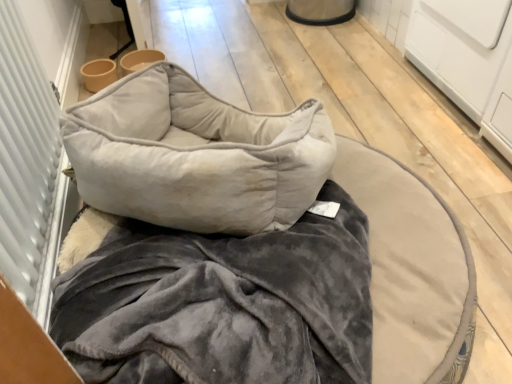
Question: Is velvet gray pet bed at center not inside velvet gray pillow at center?

Choices:
 (A) no
 (B) yes

Answer: (B)

Question: From a real-world perspective, is velvet gray pet bed at center located higher than velvet gray pillow at center?

Choices:
 (A) yes
 (B) no

Answer: (B)

Question: Are velvet gray pet bed at center and velvet gray pillow at center far apart?

Choices:
 (A) yes
 (B) no

Answer: (B)

Question: From the image's perspective, would you say velvet gray pet bed at center is positioned over velvet gray pillow at center?

Choices:
 (A) yes
 (B) no

Answer: (B)

Question: Is velvet gray pet bed at center thinner than velvet gray pillow at center?

Choices:
 (A) yes
 (B) no

Answer: (B)

Question: Can you confirm if velvet gray pet bed at center is positioned to the right of velvet gray pillow at center?

Choices:
 (A) no
 (B) yes

Answer: (B)

Question: Is velvet gray pillow at center beside white textured screen door at left?

Choices:
 (A) yes
 (B) no

Answer: (B)

Question: From the image's perspective, is velvet gray pillow at center under white textured screen door at left?

Choices:
 (A) no
 (B) yes

Answer: (B)

Question: Is velvet gray pillow at center to the right of white textured screen door at left from the viewer's perspective?

Choices:
 (A) yes
 (B) no

Answer: (A)

Question: Can white textured screen door at left be found inside velvet gray pillow at center?

Choices:
 (A) yes
 (B) no

Answer: (B)

Question: Is velvet gray pillow at center thinner than white textured screen door at left?

Choices:
 (A) yes
 (B) no

Answer: (B)

Question: Is velvet gray pillow at center bigger than white textured screen door at left?

Choices:
 (A) yes
 (B) no

Answer: (A)

Question: Does velvet gray pillow at center have a lesser width compared to velvet gray pet bed at center?

Choices:
 (A) no
 (B) yes

Answer: (B)